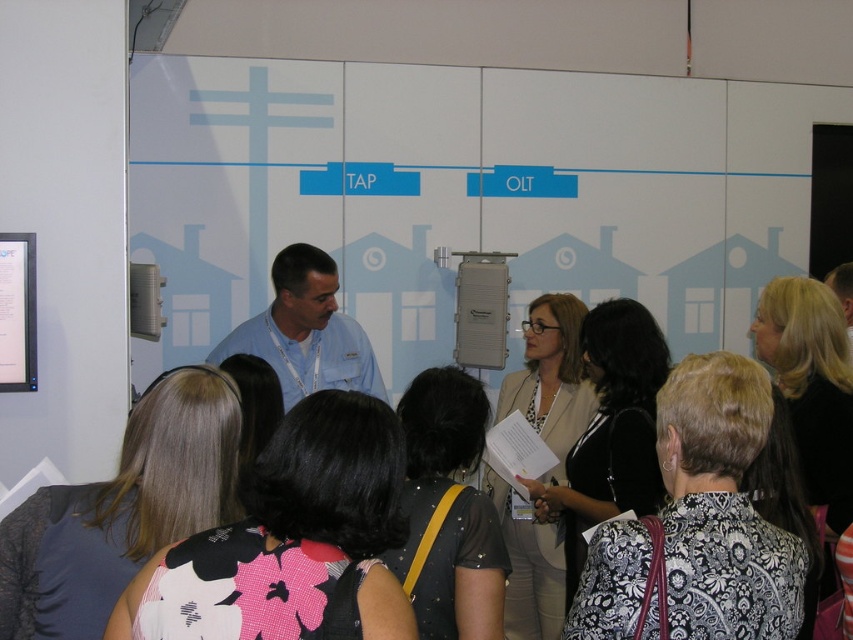
You are a photographer in the conference room and want to capture a photo where the black floral dress at center is visible above the blue shirt at center. Is this possible given their current positions?

The black floral dress at center is positioned under the blue shirt at center, so it cannot be seen above it in the current arrangement.

You are organizing a photo shoot and need to place two outfits in front of a backdrop. The black floral dress at center and the blue shirt at center must be positioned side by side. Based on their sizes, which outfit should you place on the left to ensure they fit within the frame without overlapping?

The black floral dress at center is thinner than the blue shirt at center, so placing the black floral dress at center on the left would allow both outfits to fit side by side without overlapping since it takes up less space.